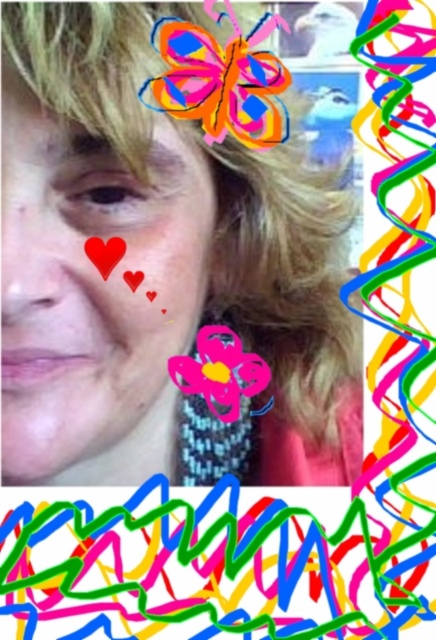
Which is behind, point (255, 88) or point (116, 243)?

The point (255, 88) is behind.

Which is above, multicolored paper butterfly at upper center or pink matte heart at upper left?

multicolored paper butterfly at upper center

This screenshot has width=436, height=640. In order to click on multicolored paper butterfly at upper center in this screenshot , I will do `click(221, 77)`.

Who is more distant from viewer, (105, 278) or (129, 282)?

The point (129, 282) is behind.

Measure the distance between point (x=102, y=269) and camera.

They are 12.16 inches apart.

Where is `pink matte heart at upper left`? pink matte heart at upper left is located at coordinates (105, 253).

Between matte skin face at left and pink matte heart at upper left, which one is positioned higher?

Positioned higher is pink matte heart at upper left.

Does point (156, 317) lie behind point (108, 273)?

Yes, it is behind point (108, 273).

Is point (64, 346) closer to viewer compared to point (122, 243)?

Yes, it is in front of point (122, 243).

Locate an element on the screen. matte skin face at left is located at coordinates (95, 296).